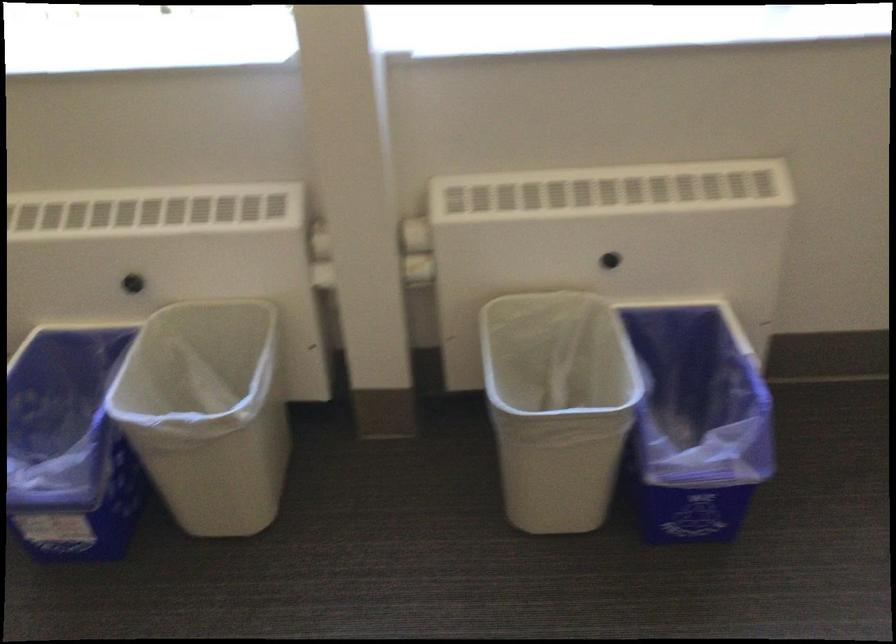
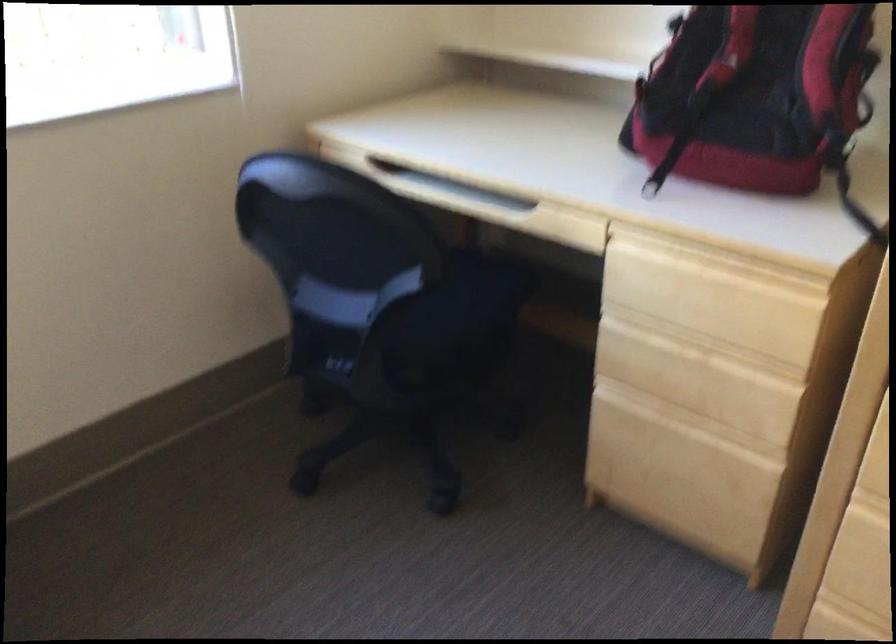
Question: Based on the continuous images, in which direction is the camera rotating? Reply with the corresponding letter.

Choices:
 (A) Left
 (B) Right
 (C) Up
 (D) Down

Answer: (B)